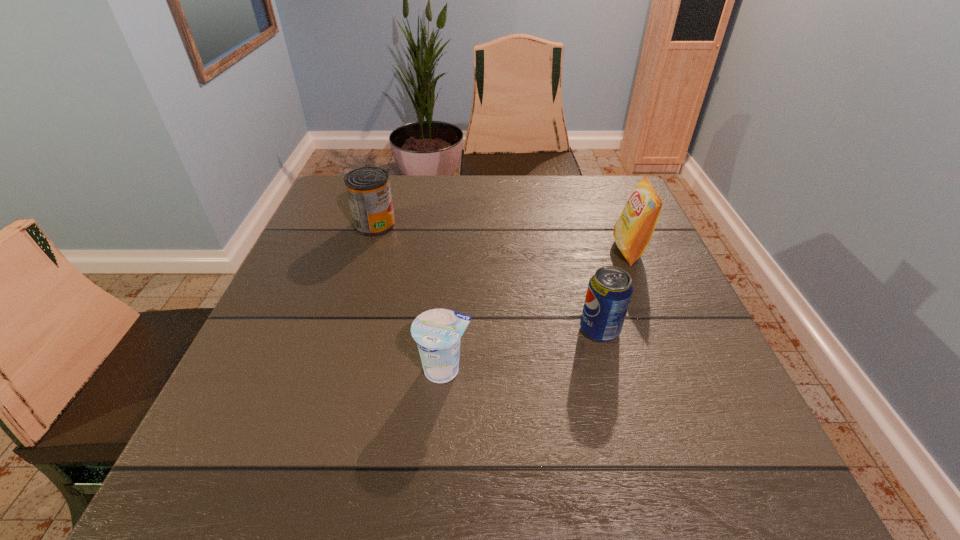
Locate an element on the screen. The image size is (960, 540). crisp (potato chip) is located at coordinates (633, 230).

Identify the location of the rightmost object. (633, 230).

Where is `the second object from right to left`? The image size is (960, 540). the second object from right to left is located at coordinates (610, 289).

Locate an element on the screen. the third farthest object is located at coordinates (610, 289).

Image resolution: width=960 pixels, height=540 pixels. What are the coordinates of `the leftmost object` in the screenshot? It's located at (368, 189).

What are the coordinates of `yogurt` in the screenshot? It's located at (438, 332).

The image size is (960, 540). I want to click on the third object from right to left, so click(438, 332).

Find the location of a particular element. The width and height of the screenshot is (960, 540). free space located on the front-facing side of the crisp (potato chip) is located at coordinates (535, 250).

At what (x,y) coordinates should I click in order to perform the action: click on vacant region located 0.330m on the front-facing side of the crisp (potato chip). Please return your answer as a coordinate pair (x, y). The width and height of the screenshot is (960, 540). Looking at the image, I should click on (477, 250).

I want to click on free space located 0.330m on the front-facing side of the crisp (potato chip), so click(x=477, y=250).